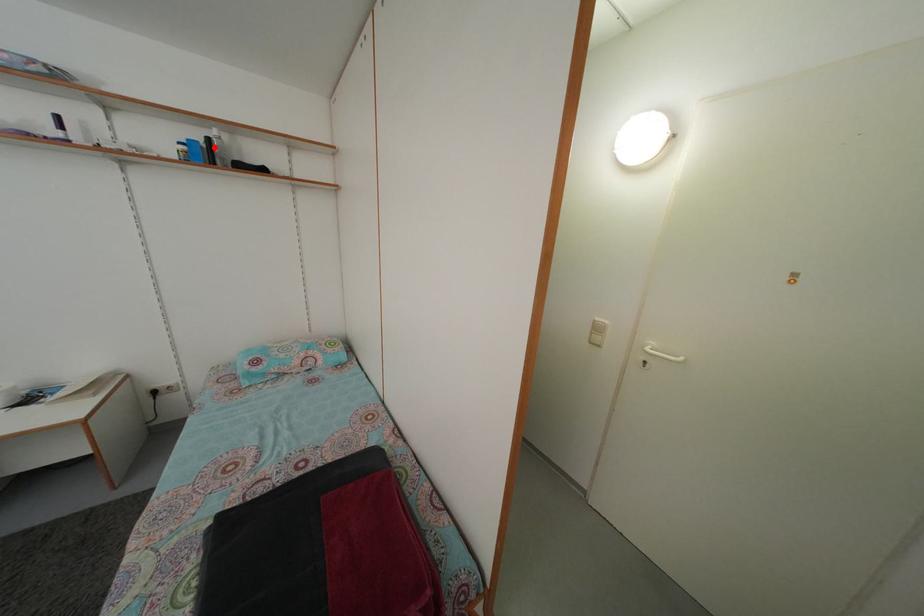
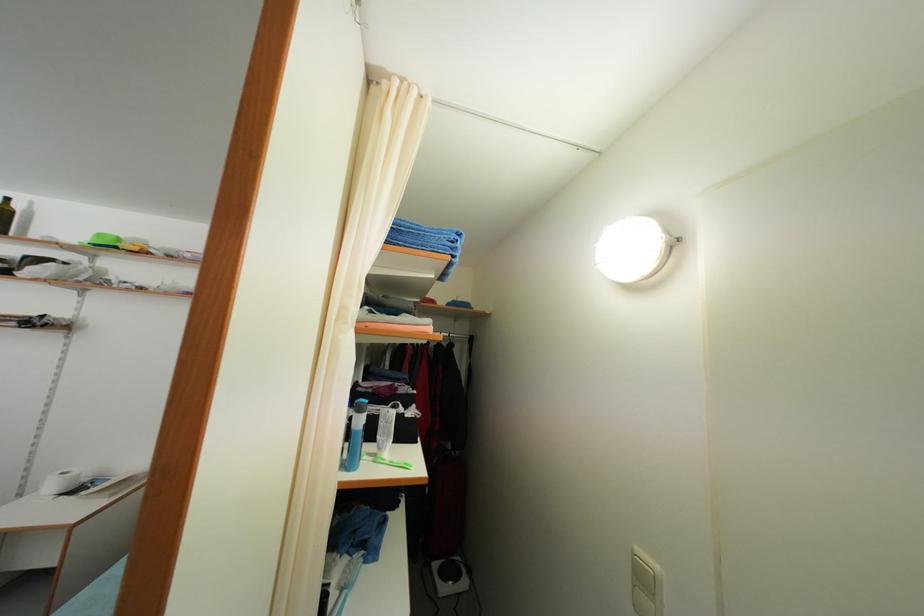
Question: I am providing you with two images of the same scene from different viewpoints. A red point is marked on the first image. Is the red point's position out of view in image 2?

Choices:
 (A) Yes
 (B) No

Answer: (A)